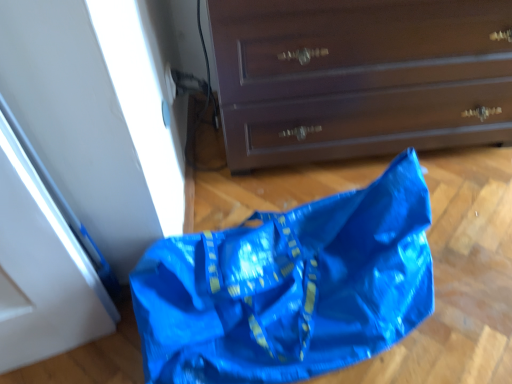
Question: Is matte brown chest of drawers at center surrounding blue plastic bag at lower left?

Choices:
 (A) no
 (B) yes

Answer: (A)

Question: Are matte brown chest of drawers at center and blue plastic bag at lower left beside each other?

Choices:
 (A) no
 (B) yes

Answer: (A)

Question: Does matte brown chest of drawers at center appear on the left side of blue plastic bag at lower left?

Choices:
 (A) yes
 (B) no

Answer: (B)

Question: Is matte brown chest of drawers at center not close to blue plastic bag at lower left?

Choices:
 (A) yes
 (B) no

Answer: (B)

Question: Is matte brown chest of drawers at center smaller than blue plastic bag at lower left?

Choices:
 (A) no
 (B) yes

Answer: (A)

Question: Is the position of matte brown chest of drawers at center more distant than that of blue plastic bag at lower left?

Choices:
 (A) no
 (B) yes

Answer: (B)

Question: From the image's perspective, would you say blue plastic bag at lower left is positioned over matte brown chest of drawers at center?

Choices:
 (A) no
 (B) yes

Answer: (A)

Question: Could you tell me if blue plastic bag at lower left is facing matte brown chest of drawers at center?

Choices:
 (A) yes
 (B) no

Answer: (B)

Question: Can matte brown chest of drawers at center be found inside blue plastic bag at lower left?

Choices:
 (A) no
 (B) yes

Answer: (A)

Question: From a real-world perspective, is blue plastic bag at lower left below matte brown chest of drawers at center?

Choices:
 (A) no
 (B) yes

Answer: (B)

Question: Is blue plastic bag at lower left further to camera compared to matte brown chest of drawers at center?

Choices:
 (A) no
 (B) yes

Answer: (A)

Question: Is blue plastic bag at lower left not inside matte brown chest of drawers at center?

Choices:
 (A) no
 (B) yes

Answer: (B)

Question: Is point (501, 129) positioned closer to the camera than point (285, 216)?

Choices:
 (A) farther
 (B) closer

Answer: (A)